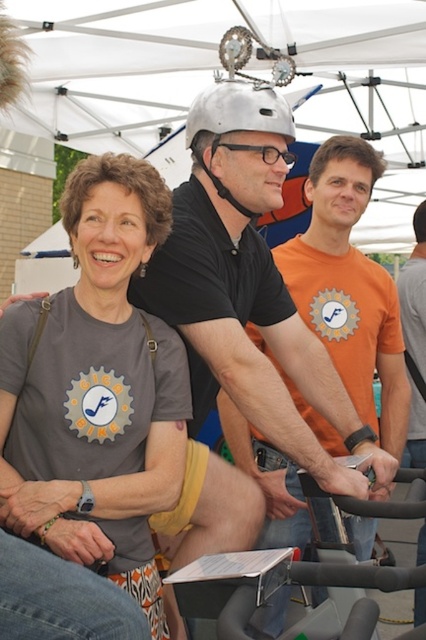
Question: Which object is positioned closest to the gray matte shirt at center?

Choices:
 (A) matte black helmet at center
 (B) silver metallic helmet at center

Answer: (B)

Question: Is gray matte shirt at center above orange cotton shirt at center?

Choices:
 (A) yes
 (B) no

Answer: (B)

Question: Which of the following is the closest to the observer?

Choices:
 (A) orange cotton shirt at center
 (B) silver metallic helmet at center
 (C) gray matte shirt at center

Answer: (C)

Question: Does gray matte shirt at center appear under transparent plastic glasses at center?

Choices:
 (A) yes
 (B) no

Answer: (A)

Question: Which point is closer to the camera?

Choices:
 (A) silver metallic helmet at center
 (B) gray matte shirt at center
 (C) white fabric canopy at upper center

Answer: (B)

Question: In this image, where is white fabric canopy at upper center located relative to matte black helmet at center?

Choices:
 (A) above
 (B) below

Answer: (A)